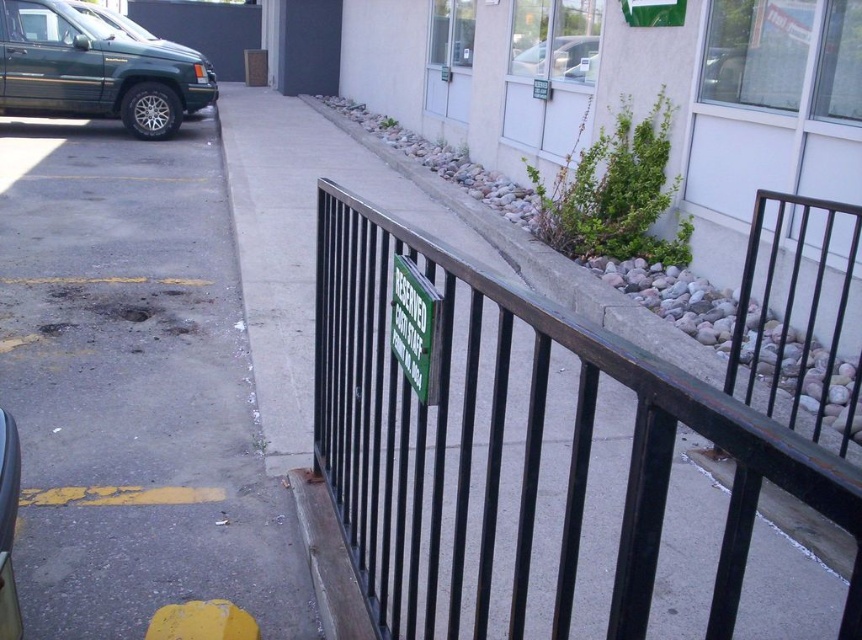
Question: Is black metal fence at center to the right of metallic silver sedan at upper center from the viewer's perspective?

Choices:
 (A) no
 (B) yes

Answer: (A)

Question: Can you confirm if black metal fence at center is positioned to the left of green matte sign at center?

Choices:
 (A) no
 (B) yes

Answer: (A)

Question: Which of these objects is positioned farthest from the green matte sign at center?

Choices:
 (A) green matte suv at left
 (B) gray asphalt at left
 (C) black metal fence at center

Answer: (A)

Question: Which point is farther from the camera taking this photo?

Choices:
 (A) (554, 48)
 (B) (422, 362)
 (C) (119, 582)
 (D) (61, 44)

Answer: (D)

Question: Can you confirm if black metal fence at center is bigger than green matte suv at left?

Choices:
 (A) yes
 (B) no

Answer: (A)

Question: Estimate the real-world distances between objects in this image. Which object is closer to the green matte sign at center?

Choices:
 (A) gray asphalt at left
 (B) metallic silver sedan at upper center
 (C) black metal fence at center

Answer: (C)